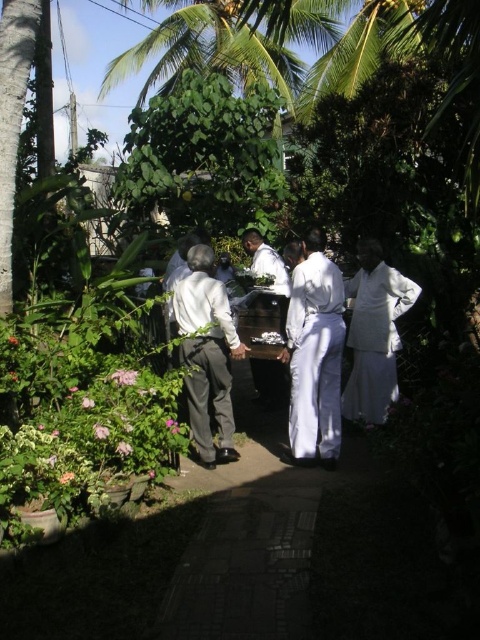
Question: Considering the real-world distances, which object is closest to the white silk robe at right?

Choices:
 (A) white clothed man at center
 (B) white matte shirt at center

Answer: (A)

Question: Observing the image, what is the correct spatial positioning of white silk robe at right in reference to white clothed man at center?

Choices:
 (A) below
 (B) above

Answer: (A)

Question: Is white cotton robe at center closer to the viewer compared to white clothed man at center?

Choices:
 (A) yes
 (B) no

Answer: (A)

Question: Which of the following is the closest to the observer?

Choices:
 (A) white silk robe at right
 (B) white cotton robe at center
 (C) white matte shirt at center
 (D) white clothed man at center

Answer: (C)

Question: From the image, what is the correct spatial relationship of white matte shirt at center in relation to white clothed man at center?

Choices:
 (A) above
 (B) below

Answer: (B)

Question: Based on their relative distances, which object is nearer to the white clothed man at center?

Choices:
 (A) white matte shirt at center
 (B) white cotton robe at center
 (C) white silk robe at right

Answer: (C)